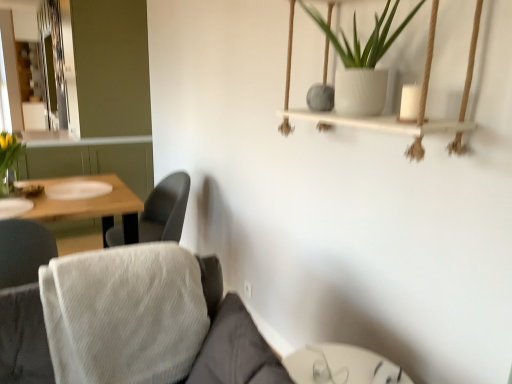
Question: Is gray fabric chair at center-left outside of clear glass vase at left?

Choices:
 (A) no
 (B) yes

Answer: (B)

Question: Is the depth of gray fabric chair at center-left greater than that of clear glass vase at left?

Choices:
 (A) yes
 (B) no

Answer: (A)

Question: From a real-world perspective, is gray fabric chair at center-left physically below clear glass vase at left?

Choices:
 (A) no
 (B) yes

Answer: (B)

Question: Does gray fabric chair at center-left have a greater width compared to clear glass vase at left?

Choices:
 (A) no
 (B) yes

Answer: (B)

Question: Is gray fabric chair at center-left in front of clear glass vase at left?

Choices:
 (A) no
 (B) yes

Answer: (A)

Question: From a real-world perspective, relative to clear glass vase at left, is transparent glass table at lower center vertically above or below?

Choices:
 (A) above
 (B) below

Answer: (B)

Question: Considering the positions of transparent glass table at lower center and clear glass vase at left in the image, is transparent glass table at lower center wider or thinner than clear glass vase at left?

Choices:
 (A) thin
 (B) wide

Answer: (B)

Question: Relative to clear glass vase at left, is transparent glass table at lower center in front or behind?

Choices:
 (A) behind
 (B) front

Answer: (B)

Question: From the image's perspective, is transparent glass table at lower center located above or below clear glass vase at left?

Choices:
 (A) below
 (B) above

Answer: (A)

Question: Visually, is white textured pot at upper center positioned to the left or to the right of white fabric couch at lower left?

Choices:
 (A) left
 (B) right

Answer: (B)

Question: Would you say white textured pot at upper center is inside or outside white fabric couch at lower left?

Choices:
 (A) outside
 (B) inside

Answer: (A)

Question: Considering the positions of white textured pot at upper center and white fabric couch at lower left in the image, is white textured pot at upper center bigger or smaller than white fabric couch at lower left?

Choices:
 (A) small
 (B) big

Answer: (A)

Question: Is point (391, 39) positioned closer to the camera than point (249, 352)?

Choices:
 (A) closer
 (B) farther

Answer: (B)

Question: Is point (10, 188) positioned closer to the camera than point (351, 349)?

Choices:
 (A) closer
 (B) farther

Answer: (B)

Question: Based on their positions, is clear glass vase at left located to the left or right of transparent glass table at lower center?

Choices:
 (A) right
 (B) left

Answer: (B)